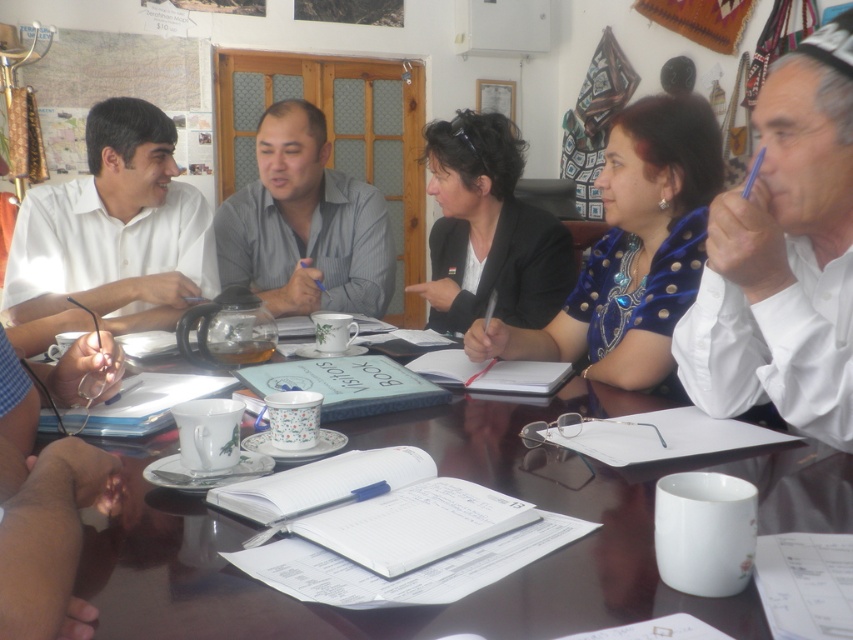
You are a person who is 1.7 meters tall. You are sitting at the glossy wooden table at center and wearing the white shirt at right. Do you think the table is taller or shorter than your shirt?

The glossy wooden table at center has a lesser height compared to white shirt at right, so the table is shorter than your shirt.

You are standing at the point labeled as point [650,236] in the image. You want to take a photo of the entire table setup. The camera you have is 1.64 meters away from you. Is the camera within your reach to take the photo?

The point [650,236] and the camera are 1.64 meters apart from each other. Since the camera is 1.64 meters away from you, it is within your reach to take the photo.